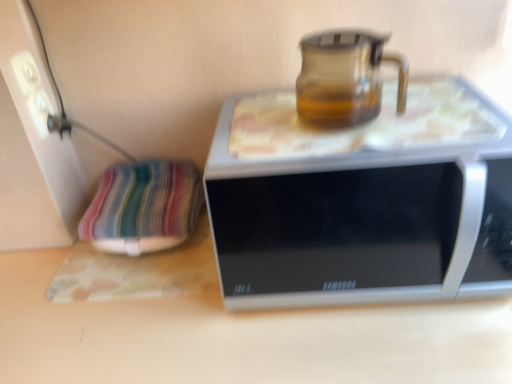
Question: Is point (24, 91) closer or farther from the camera than point (509, 172)?

Choices:
 (A) closer
 (B) farther

Answer: (B)

Question: In terms of width, does white plastic socket at upper left look wider or thinner when compared to silver metallic microwave at center?

Choices:
 (A) wide
 (B) thin

Answer: (B)

Question: Which of these objects is positioned closest to the transparent glass jug at upper center?

Choices:
 (A) striped fabric pillow at left
 (B) smooth wooden table at center
 (C) silver metallic microwave at center
 (D) white plastic socket at upper left

Answer: (C)

Question: Estimate the real-world distances between objects in this image. Which object is closer to the silver metallic microwave at center?

Choices:
 (A) white plastic socket at upper left
 (B) smooth wooden table at center
 (C) transparent glass jug at upper center
 (D) striped fabric pillow at left

Answer: (C)